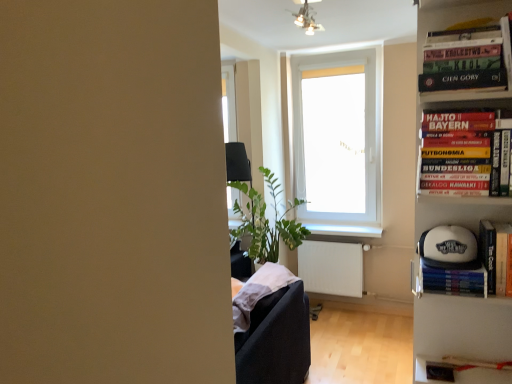
At what (x,y) coordinates should I click in order to perform the action: click on hardcover book at right, the 2th book in the top-to-bottom sequence. Please return your answer as a coordinate pair (x, y). Looking at the image, I should click on (458, 154).

Describe the element at coordinates (344, 230) in the screenshot. The width and height of the screenshot is (512, 384). I see `white glossy window sill at center` at that location.

Where is `metallic ceiling lights at upper center`? The image size is (512, 384). metallic ceiling lights at upper center is located at coordinates pyautogui.click(x=307, y=17).

This screenshot has width=512, height=384. Describe the element at coordinates (453, 278) in the screenshot. I see `white matte baseball cap at right` at that location.

In order to face white plastic bookcase at right, should I rotate leftwards or rightwards?

You should rotate right by 26.514 degrees.

This screenshot has width=512, height=384. Describe the element at coordinates (338, 141) in the screenshot. I see `white plastic window at center` at that location.

Identify the location of white plastic window at center. pyautogui.click(x=338, y=141).

You are a GUI agent. You are given a task and a screenshot of the screen. Output one action in this format:
    pyautogui.click(x=<x>, y=<y>)
    Task: Click on the hardcover book at right, the 2th book in the top-to-bottom sequence
    The width and height of the screenshot is (512, 384).
    Given the screenshot: What is the action you would take?
    pyautogui.click(x=458, y=154)

Could you tell me if metallic ceiling lights at upper center is turned towards white matte radiator at lower right?

No, metallic ceiling lights at upper center is not facing towards white matte radiator at lower right.

Looking at this image, considering the relative sizes of metallic ceiling lights at upper center and white matte radiator at lower right in the image provided, is metallic ceiling lights at upper center thinner than white matte radiator at lower right?

In fact, metallic ceiling lights at upper center might be wider than white matte radiator at lower right.

Is metallic ceiling lights at upper center located outside white matte radiator at lower right?

Absolutely, metallic ceiling lights at upper center is external to white matte radiator at lower right.

Which object is positioned more to the left, white plastic window at center or white matte radiator at lower right?

Positioned to the left is white matte radiator at lower right.

Which object is closer to the camera, white plastic window at center or white matte radiator at lower right?

Positioned in front is white plastic window at center.

At what (x,y) coordinates should I click in order to perform the action: click on window that is in front of the white matte radiator at lower right. Please return your answer as a coordinate pair (x, y). The height and width of the screenshot is (384, 512). Looking at the image, I should click on (338, 141).

Who is smaller, hardcover book at upper right, which appears as the first book when viewed from the top, or white matte baseball cap at right?

With smaller size is white matte baseball cap at right.

Considering the sizes of objects hardcover book at upper right, which appears as the first book when viewed from the top, and white matte baseball cap at right in the image provided, who is thinner, hardcover book at upper right, which appears as the first book when viewed from the top, or white matte baseball cap at right?

Thinner between the two is hardcover book at upper right, which appears as the first book when viewed from the top.

From the image's perspective, relative to white matte baseball cap at right, is hardcover book at upper right, the 3th book from the bottom, above or below?

Based on their image positions, hardcover book at upper right, the 3th book from the bottom, is located above white matte baseball cap at right.

Does point (464, 270) appear closer or farther from the camera than point (494, 56)?

Point (464, 270).

This screenshot has width=512, height=384. Identify the location of paperback book behind the hardcover book at upper right, the 3th book from the bottom. pos(453,278).

Considering the relative sizes of white matte baseball cap at right and hardcover book at upper right, the 3th book from the bottom, in the image provided, is white matte baseball cap at right shorter than hardcover book at upper right, the 3th book from the bottom,?

Yes, white matte baseball cap at right is shorter than hardcover book at upper right, the 3th book from the bottom.

Considering the sizes of objects white matte baseball cap at right and metallic ceiling lights at upper center in the image provided, who is taller, white matte baseball cap at right or metallic ceiling lights at upper center?

metallic ceiling lights at upper center is taller.

From the image's perspective, relative to metallic ceiling lights at upper center, is white matte baseball cap at right above or below?

Clearly, from the image's perspective, white matte baseball cap at right is below metallic ceiling lights at upper center.

From a real-world perspective, which object rests below the other?

white matte baseball cap at right.

Which point is more forward, (x=446, y=282) or (x=295, y=22)?

The point (x=446, y=282) is closer.

Does hardcover book at right, the 2th book in the top-to-bottom sequence, have a lesser height compared to hardcover book at upper right, which appears as the first book when viewed from the top?

In fact, hardcover book at right, the 2th book in the top-to-bottom sequence, may be taller than hardcover book at upper right, which appears as the first book when viewed from the top.

Does point (463, 173) come in front of point (480, 55)?

No, (463, 173) is further to viewer.

Is hardcover book at right, which appears as the 2th book when ordered from the bottom, far from hardcover book at upper right, which appears as the first book when viewed from the top?

No, hardcover book at right, which appears as the 2th book when ordered from the bottom, is not far away from hardcover book at upper right, which appears as the first book when viewed from the top.

In the scene shown: Which is more to the right, hardcover book at right, the 2th book in the top-to-bottom sequence, or hardcover book at upper right, the 3th book from the bottom?

From the viewer's perspective, hardcover book at right, the 2th book in the top-to-bottom sequence, appears more on the right side.

Between metallic ceiling lights at upper center and white plastic bookcase at right, which one is positioned behind?

metallic ceiling lights at upper center is further away from the camera.

The height and width of the screenshot is (384, 512). In order to click on light fixture that is above the white plastic bookcase at right (from a real-world perspective) in this screenshot , I will do `click(307, 17)`.

Consider the image. From the image's perspective, is metallic ceiling lights at upper center located above or below white plastic bookcase at right?

Based on their image positions, metallic ceiling lights at upper center is located above white plastic bookcase at right.

Can you confirm if metallic ceiling lights at upper center is positioned to the left of white plastic bookcase at right?

Correct, you'll find metallic ceiling lights at upper center to the left of white plastic bookcase at right.

The height and width of the screenshot is (384, 512). Find the location of `light fixture lying in front of the white matte radiator at lower right`. light fixture lying in front of the white matte radiator at lower right is located at coordinates (307, 17).

Find the location of a particular element. radiator behind the white plastic window at center is located at coordinates (331, 267).

Estimate the real-world distances between objects in this image. Which object is closer to white plastic window at center, white matte baseball cap at right or white glossy window sill at center?

white glossy window sill at center lies closer to white plastic window at center than the other object.

From the image, which object appears to be nearer to white matte baseball cap at right, white matte radiator at lower right or hardcover book at right, which appears as the 2th book when ordered from the bottom?

hardcover book at right, which appears as the 2th book when ordered from the bottom, is positioned closer to the anchor white matte baseball cap at right.

From the image, which object appears to be nearer to white matte baseball cap at right, the third book viewed from the top, white plastic window at center or white glossy window sill at center?

The object closer to white matte baseball cap at right, the third book viewed from the top, is white glossy window sill at center.

From the image, which object appears to be nearer to white matte baseball cap at right, the third book viewed from the top, white matte baseball cap at right or white matte radiator at lower right?

white matte baseball cap at right lies closer to white matte baseball cap at right, the third book viewed from the top, than the other object.

Looking at this image, based on their spatial positions, is white plastic window at center or white plastic bookcase at right further from hardcover book at right, which appears as the 2th book when ordered from the bottom?

white plastic window at center.

From the image, which object appears to be nearer to hardcover book at upper right, which appears as the first book when viewed from the top, white matte baseball cap at right, the 1th book from the bottom, or metallic ceiling lights at upper center?

The object closer to hardcover book at upper right, which appears as the first book when viewed from the top, is white matte baseball cap at right, the 1th book from the bottom.

Which object lies further to the anchor point white plastic bookcase at right, metallic ceiling lights at upper center or hardcover book at right, the 2th book in the top-to-bottom sequence?

The object further to white plastic bookcase at right is metallic ceiling lights at upper center.

Considering their positions, is hardcover book at upper right, which appears as the first book when viewed from the top, positioned further to white plastic window at center than white matte baseball cap at right?

white matte baseball cap at right is positioned further to the anchor white plastic window at center.

You are a GUI agent. You are given a task and a screenshot of the screen. Output one action in this format:
    pyautogui.click(x=<x>, y=<y>)
    Task: Click on the paperback book between hardcover book at upper right, the 3th book from the bottom, and white matte radiator at lower right, along the z-axis
    The height and width of the screenshot is (384, 512).
    Given the screenshot: What is the action you would take?
    453,278

Where is `light fixture between hardcover book at upper right, which appears as the first book when viewed from the top, and white plastic window at center from front to back`? This screenshot has height=384, width=512. light fixture between hardcover book at upper right, which appears as the first book when viewed from the top, and white plastic window at center from front to back is located at coordinates (307, 17).

In order to click on paperback book between hardcover book at right, which appears as the 2th book when ordered from the bottom, and white glossy window sill at center, along the z-axis in this screenshot , I will do `click(453, 278)`.

Image resolution: width=512 pixels, height=384 pixels. Find the location of `light fixture between hardcover book at upper right, the 3th book from the bottom, and white glossy window sill at center from front to back`. light fixture between hardcover book at upper right, the 3th book from the bottom, and white glossy window sill at center from front to back is located at coordinates (307, 17).